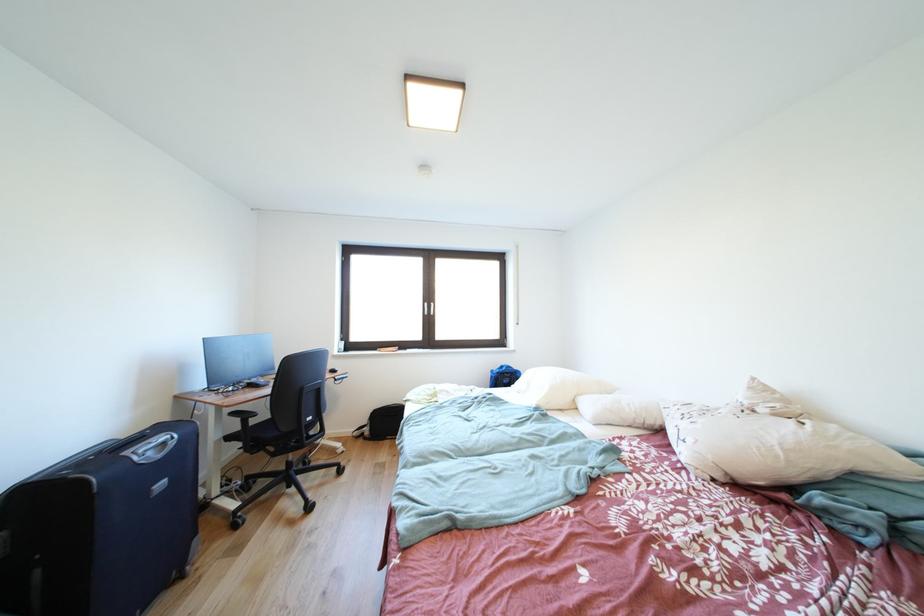
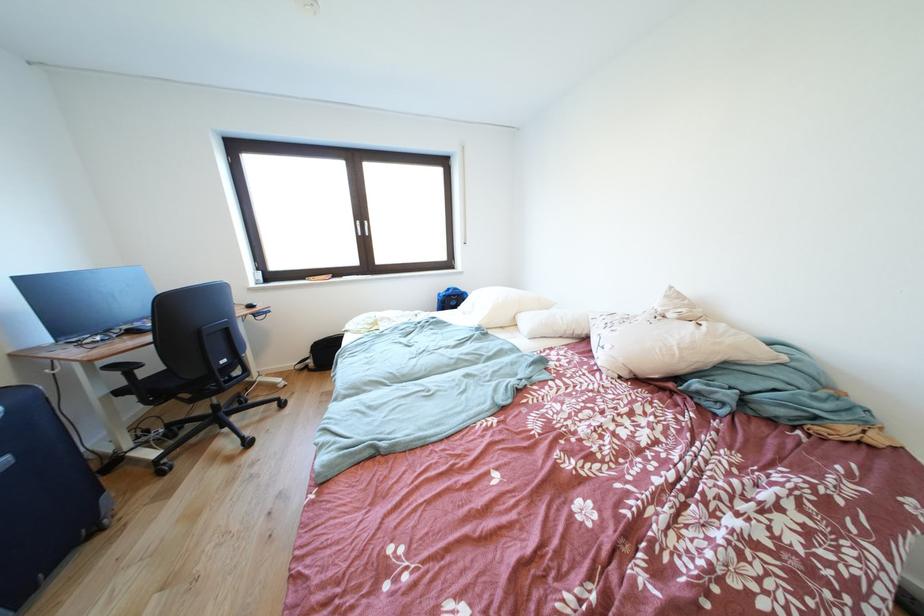
Locate, in the second image, the point that corresponds to pixel 371 439 in the first image.

(315, 371)